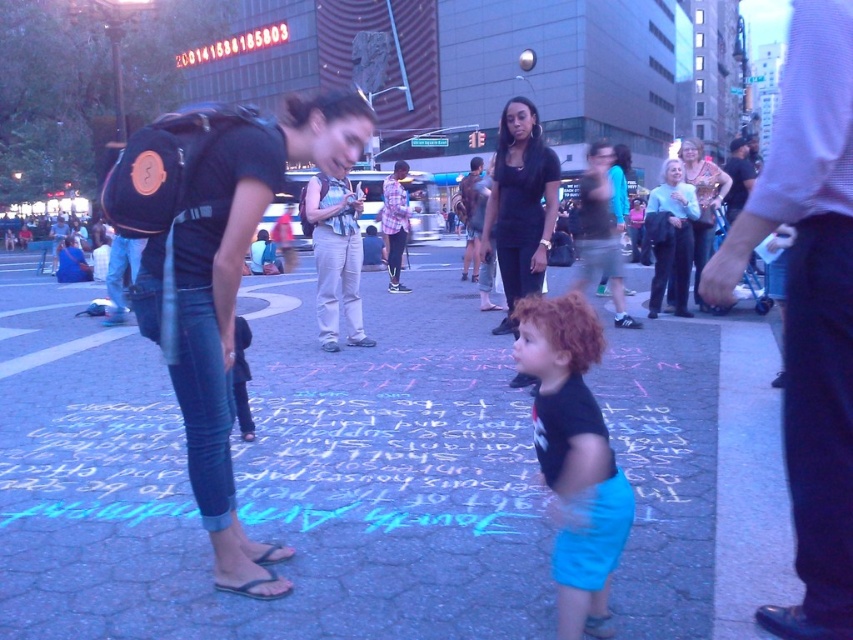
You are a photographer trying to capture a photo of the black matte shirt at center and the light blue sweater at upper right. Which one is located to the left of the other?

The black matte shirt at center is positioned on the left side of light blue sweater at upper right.